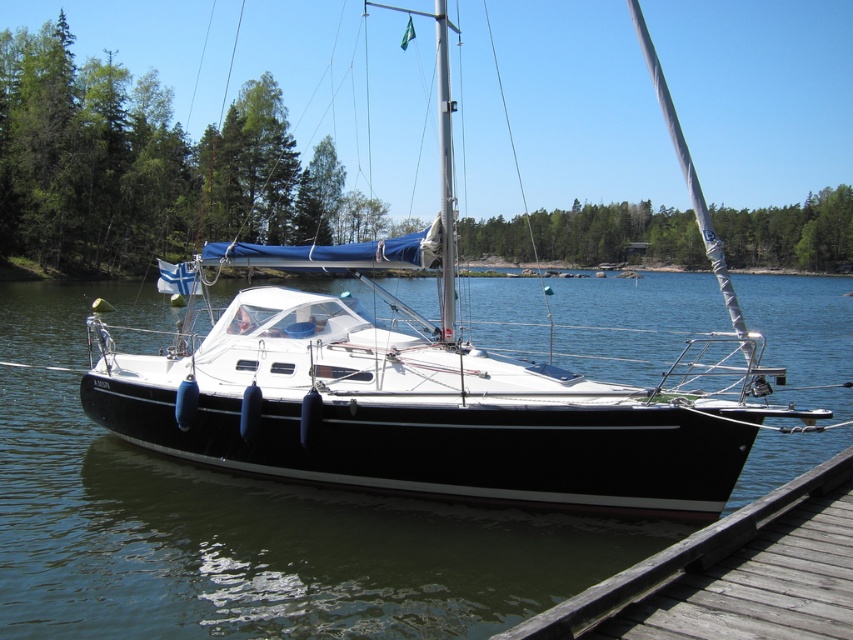
Question: Does white glossy sailboat at center appear on the right side of weathered wood dock at lower right?

Choices:
 (A) yes
 (B) no

Answer: (A)

Question: In this image, where is white glossy sailboat at center located relative to weathered wood dock at lower right?

Choices:
 (A) left
 (B) right

Answer: (B)

Question: Is black glossy water at center bigger than white glossy sailboat at center?

Choices:
 (A) no
 (B) yes

Answer: (A)

Question: Which is nearer to the weathered wood dock at lower right?

Choices:
 (A) white glossy sailboat at center
 (B) black glossy water at center

Answer: (A)

Question: Which object is positioned farthest from the black glossy water at center?

Choices:
 (A) white glossy sailboat at center
 (B) weathered wood dock at lower right

Answer: (B)

Question: Estimate the real-world distances between objects in this image. Which object is farther from the weathered wood dock at lower right?

Choices:
 (A) white glossy sailboat at center
 (B) black glossy water at center

Answer: (B)